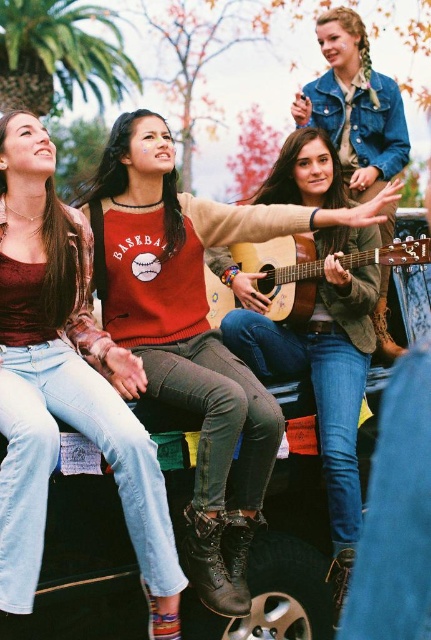
You are a photographer standing in front of the pickup truck where the women are sitting. You notice two points marked in the image. Which point, point at (x=390, y=340) or point at (x=422, y=237), is closer to you?

Point at (x=390, y=340) is closer to you because it is further to the camera than point at (x=422, y=237).

What is the position of the matte brown guitar at center in the image?

The matte brown guitar at center is located at point (355, 106).